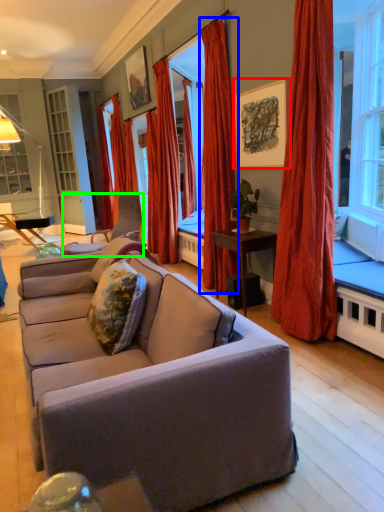
Question: Estimate the real-world distances between objects in this image. Which object is closer to picture frame (highlighted by a red box), curtain (highlighted by a blue box) or chair (highlighted by a green box)?

Choices:
 (A) curtain
 (B) chair

Answer: (A)